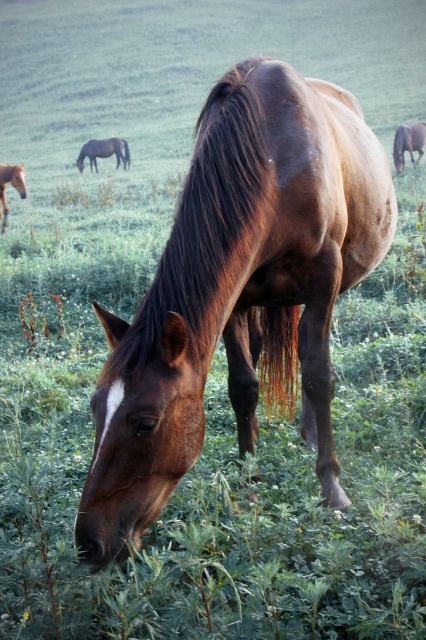
You are standing in the field and see two points in the scene, point (92,145) and point (400,156). Which point is closer to you?

Point (92,145) is closer to you because it is further to the viewer than point (400,156).

You are a photographer trying to capture the brown glossy horse at upper left and the brown glossy horse at left in a single frame. Based on their sizes in the image, which horse would appear closer to the camera?

The brown glossy horse at upper left appears bigger than the brown glossy horse at left, so it would be closer to the camera.

You are standing in the field and want to locate the brown glossy horse at upper left. According to the coordinates provided, where should you look relative to the center of the image?

The brown glossy horse at upper left is located at coordinates 0.237 on the x axis and 0.244 on the y axis, which is slightly to the left and slightly above the center of the image.